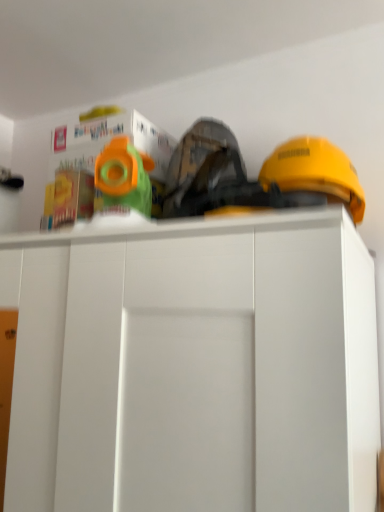
Question: Considering the positions of white matte cabinet at center and yellow hard hat at upper right in the image, is white matte cabinet at center wider or thinner than yellow hard hat at upper right?

Choices:
 (A) thin
 (B) wide

Answer: (B)

Question: Would you say white matte cabinet at center is inside or outside yellow hard hat at upper right?

Choices:
 (A) inside
 (B) outside

Answer: (B)

Question: Which of these objects is positioned farthest from the yellow hard hat at upper right?

Choices:
 (A) green plastic toy at upper center, which ranks as the first toy in right-to-left order
 (B) white matte cabinet at center
 (C) matte plastic toy at upper left, positioned as the 1th toy in left-to-right order

Answer: (C)

Question: Estimate the real-world distances between objects in this image. Which object is farther from the white matte cabinet at center?

Choices:
 (A) green plastic toy at upper center, which ranks as the first toy in right-to-left order
 (B) matte plastic toy at upper left, positioned as the 1th toy in left-to-right order
 (C) yellow hard hat at upper right

Answer: (C)